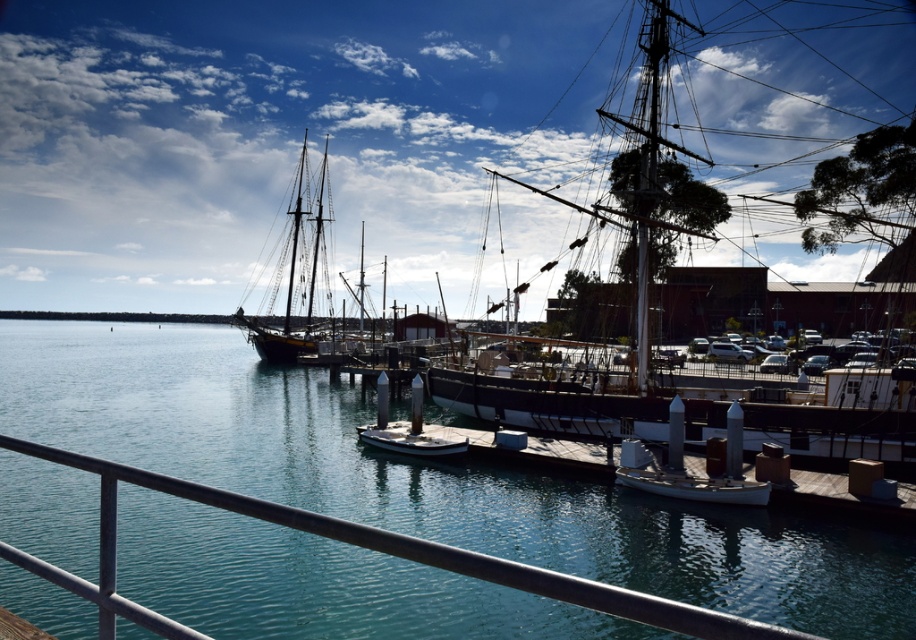
You are standing on the dock and need to pass through the area between the metallic silver posts at center and the white matte dock at center. Can you walk through this space comfortably?

The metallic silver posts at center are narrower than the white matte dock at center, so there should be enough space to walk through comfortably.

You are standing on the dock and want to reach the metallic gray rail at lower center. Based on the coordinates provided, which direction should you move from your current position at point (365, 547)?

The coordinates point directly to the metallic gray rail at lower center, so you are already at the location of the metallic gray rail at lower center.

From the picture: You are a tourist standing on the white matte dock at center and want to board the white wooden ship at center. Based on their sizes, which one is bigger?

The white wooden ship at center has a larger size compared to the white matte dock at center, so the ship is bigger.